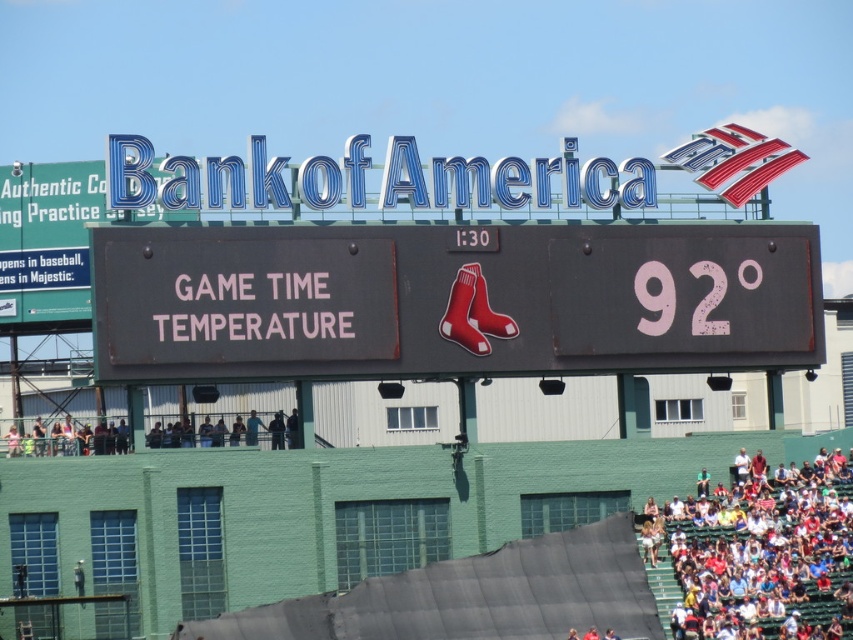
Which is more to the left, black matte scoreboard at center or dark gray concrete crowd at lower left?

From the viewer's perspective, dark gray concrete crowd at lower left appears more on the left side.

Identify the location of black matte scoreboard at center. (451, 300).

Who is more distant from viewer, (144,300) or (788,570)?

Point (788,570)

You are a GUI agent. You are given a task and a screenshot of the screen. Output one action in this format:
    pyautogui.click(x=<x>, y=<y>)
    Task: Click on the black matte scoreboard at center
    Image resolution: width=853 pixels, height=640 pixels.
    Given the screenshot: What is the action you would take?
    pyautogui.click(x=451, y=300)

Is white fabric seats at lower right wider than dark gray concrete crowd at lower left?

In fact, white fabric seats at lower right might be narrower than dark gray concrete crowd at lower left.

At what (x,y) coordinates should I click in order to perform the action: click on white fabric seats at lower right. Please return your answer as a coordinate pair (x, y). Looking at the image, I should click on (764, 560).

At what (x,y) coordinates should I click in order to perform the action: click on white fabric seats at lower right. Please return your answer as a coordinate pair (x, y). Image resolution: width=853 pixels, height=640 pixels. Looking at the image, I should click on (764, 560).